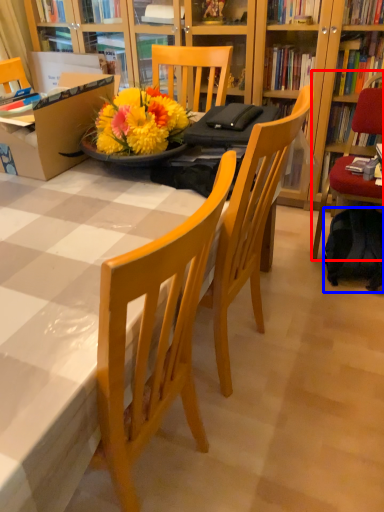
Question: Which point is closer to the camera, chair (highlighted by a red box) or backpack (highlighted by a blue box)?

Choices:
 (A) chair
 (B) backpack

Answer: (A)